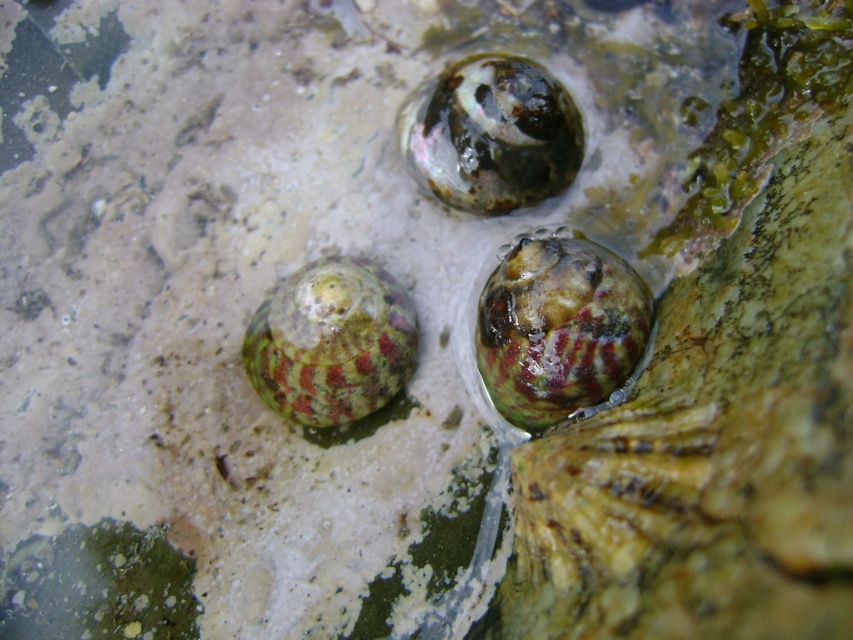
You are a marine biologist examining the image. You need to determine which shell is wider between the green mottled shell at center and the speckled stone shell at upper center. Which one is wider?

The green mottled shell at center has a lesser width compared to the speckled stone shell at upper center, so the speckled stone shell at upper center is wider.

You are a marine biologist examining the image of the three small organisms on the textured surface. You notice a point marked at coordinates (558,328). Which organism does this point correspond to?

The point at coordinates (558,328) corresponds to the green mottled shell at center as described in the objects description.